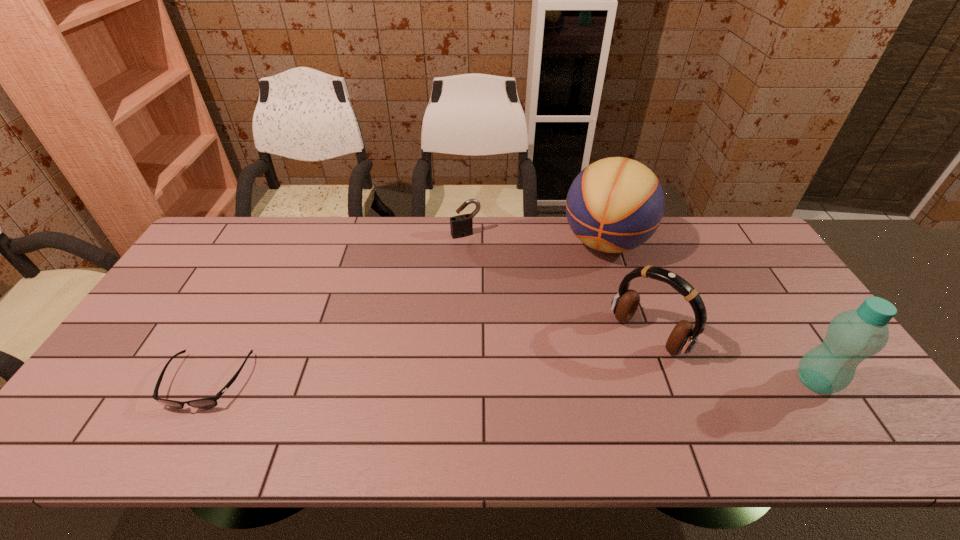
Where is `vacant space located 0.210m with the keyhole on the front of the fourth tallest object`? Image resolution: width=960 pixels, height=540 pixels. vacant space located 0.210m with the keyhole on the front of the fourth tallest object is located at coordinates (492, 278).

Locate an element on the screen. This screenshot has height=540, width=960. vacant point located on the ear cup of the third tallest object is located at coordinates (611, 373).

Find the location of a particular element. The width and height of the screenshot is (960, 540). vacant space located on the ear cup of the third tallest object is located at coordinates (602, 383).

Locate an element on the screen. Image resolution: width=960 pixels, height=540 pixels. vacant space positioned 0.160m on the ear cup of the third tallest object is located at coordinates (592, 393).

Image resolution: width=960 pixels, height=540 pixels. Find the location of `vacant region located on the patterned surface of the basketball`. vacant region located on the patterned surface of the basketball is located at coordinates (585, 285).

You are a GUI agent. You are given a task and a screenshot of the screen. Output one action in this format:
    pyautogui.click(x=<x>, y=<y>)
    Task: Click on the free location located 0.310m on the patterned surface of the basketball
    This screenshot has height=540, width=960.
    Given the screenshot: What is the action you would take?
    pyautogui.click(x=559, y=336)

I want to click on blank space located on the patterned surface of the basketball, so click(574, 306).

I want to click on padlock that is at the far edge, so click(461, 226).

What are the coordinates of `basketball present at the far edge` in the screenshot? It's located at (614, 205).

This screenshot has width=960, height=540. Find the location of `sunglasses present at the near edge`. sunglasses present at the near edge is located at coordinates (205, 403).